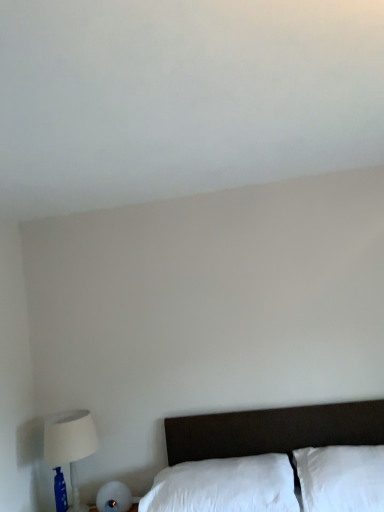
Where is `white soft pillow at lower center, positioned as the 1th pillow in left-to-right order`? This screenshot has height=512, width=384. white soft pillow at lower center, positioned as the 1th pillow in left-to-right order is located at coordinates (224, 486).

Is white fabric lampshade at left with white soft pillow at lower right, the first pillow viewed from the right?

No, white fabric lampshade at left is not next to white soft pillow at lower right, the first pillow viewed from the right.

Is the position of white fabric lampshade at left more distant than that of white soft pillow at lower right, which is the second pillow in left-to-right order?

Yes, white fabric lampshade at left is further from the viewer.

At what (x,y) coordinates should I click in order to perform the action: click on table lamp above the white soft pillow at lower right, which is the second pillow in left-to-right order (from a real-world perspective). Please return your answer as a coordinate pair (x, y). Image resolution: width=384 pixels, height=512 pixels. Looking at the image, I should click on (70, 445).

Which of these two, white fabric lampshade at left or white soft pillow at lower right, the first pillow viewed from the right, stands shorter?

With less height is white soft pillow at lower right, the first pillow viewed from the right.

Is white soft pillow at lower right, the first pillow viewed from the right, looking in the opposite direction of white soft pillow at lower center, positioned as the 1th pillow in left-to-right order?

No, white soft pillow at lower center, positioned as the 1th pillow in left-to-right order, is not at the back of white soft pillow at lower right, the first pillow viewed from the right.

Does white soft pillow at lower right, which is the second pillow in left-to-right order, have a larger size compared to white soft pillow at lower center, positioned as the 1th pillow in left-to-right order?

Incorrect, white soft pillow at lower right, which is the second pillow in left-to-right order, is not larger than white soft pillow at lower center, positioned as the 1th pillow in left-to-right order.

Can you confirm if white soft pillow at lower right, which is the second pillow in left-to-right order, is thinner than white soft pillow at lower center, the second pillow in the right-to-left sequence?

Correct, the width of white soft pillow at lower right, which is the second pillow in left-to-right order, is less than that of white soft pillow at lower center, the second pillow in the right-to-left sequence.

In the image, is white soft pillow at lower right, which is the second pillow in left-to-right order, positioned in front of or behind white soft pillow at lower center, positioned as the 1th pillow in left-to-right order?

In the image, white soft pillow at lower right, which is the second pillow in left-to-right order, appears in front of white soft pillow at lower center, positioned as the 1th pillow in left-to-right order.

Does white fabric lampshade at left have a lesser width compared to white soft pillow at lower center, positioned as the 1th pillow in left-to-right order?

Indeed, white fabric lampshade at left has a lesser width compared to white soft pillow at lower center, positioned as the 1th pillow in left-to-right order.

There is a white fabric lampshade at left. At what (x,y) coordinates should I click in order to perform the action: click on the 2nd pillow below it (from a real-world perspective). Please return your answer as a coordinate pair (x, y). This screenshot has height=512, width=384. Looking at the image, I should click on (224, 486).

Could you measure the distance between white fabric lampshade at left and white soft pillow at lower center, the second pillow in the right-to-left sequence?

They are 26.26 inches apart.

Considering the relative sizes of white fabric lampshade at left and white soft pillow at lower center, positioned as the 1th pillow in left-to-right order, in the image provided, is white fabric lampshade at left bigger than white soft pillow at lower center, positioned as the 1th pillow in left-to-right order,?

No.

Between white soft pillow at lower right, the first pillow viewed from the right, and white fabric lampshade at left, which one is positioned in front?

white soft pillow at lower right, the first pillow viewed from the right, is in front.

Is white soft pillow at lower right, which is the second pillow in left-to-right order, inside the boundaries of white fabric lampshade at left, or outside?

white soft pillow at lower right, which is the second pillow in left-to-right order, is outside white fabric lampshade at left.

Consider the image. Which object is thinner, white soft pillow at lower right, which is the second pillow in left-to-right order, or white fabric lampshade at left?

white fabric lampshade at left.

Is the surface of white soft pillow at lower right, which is the second pillow in left-to-right order, in direct contact with white fabric lampshade at left?

No, white soft pillow at lower right, which is the second pillow in left-to-right order, is not touching white fabric lampshade at left.

Considering the positions of objects white soft pillow at lower center, positioned as the 1th pillow in left-to-right order, and white fabric lampshade at left in the image provided, who is more to the right, white soft pillow at lower center, positioned as the 1th pillow in left-to-right order, or white fabric lampshade at left?

From the viewer's perspective, white soft pillow at lower center, positioned as the 1th pillow in left-to-right order, appears more on the right side.

Which of these two, white soft pillow at lower center, positioned as the 1th pillow in left-to-right order, or white fabric lampshade at left, is bigger?

Bigger between the two is white soft pillow at lower center, positioned as the 1th pillow in left-to-right order.

From the picture: From the image's perspective, which object appears higher, white soft pillow at lower center, the second pillow in the right-to-left sequence, or white fabric lampshade at left?

white fabric lampshade at left, from the image's perspective.

From a real-world perspective, count 2nd pillows downward from the white fabric lampshade at left and point to it. Please provide its 2D coordinates.

[(224, 486)]

In the scene shown: Measure the distance between white soft pillow at lower center, positioned as the 1th pillow in left-to-right order, and white soft pillow at lower right, which is the second pillow in left-to-right order.

A distance of 26.45 centimeters exists between white soft pillow at lower center, positioned as the 1th pillow in left-to-right order, and white soft pillow at lower right, which is the second pillow in left-to-right order.

Is white soft pillow at lower center, positioned as the 1th pillow in left-to-right order, aimed at white soft pillow at lower right, which is the second pillow in left-to-right order?

No, white soft pillow at lower center, positioned as the 1th pillow in left-to-right order, is not turned towards white soft pillow at lower right, which is the second pillow in left-to-right order.

Would you consider white soft pillow at lower center, the second pillow in the right-to-left sequence, to be distant from white soft pillow at lower right, which is the second pillow in left-to-right order?

No.

Who is more distant, white soft pillow at lower center, positioned as the 1th pillow in left-to-right order, or white soft pillow at lower right, the first pillow viewed from the right?

white soft pillow at lower center, positioned as the 1th pillow in left-to-right order, is further away from the camera.

What are the coordinates of `table lamp on the left of the white soft pillow at lower right, the first pillow viewed from the right` in the screenshot? It's located at (70, 445).

At what (x,y) coordinates should I click in order to perform the action: click on pillow above the white soft pillow at lower center, positioned as the 1th pillow in left-to-right order (from the image's perspective). Please return your answer as a coordinate pair (x, y). The height and width of the screenshot is (512, 384). Looking at the image, I should click on (341, 478).

From the image, which object appears to be nearer to white soft pillow at lower right, the first pillow viewed from the right, white fabric lampshade at left or white soft pillow at lower center, the second pillow in the right-to-left sequence?

white soft pillow at lower center, the second pillow in the right-to-left sequence, lies closer to white soft pillow at lower right, the first pillow viewed from the right, than the other object.

Estimate the real-world distances between objects in this image. Which object is further from white soft pillow at lower center, the second pillow in the right-to-left sequence, white soft pillow at lower right, the first pillow viewed from the right, or white fabric lampshade at left?

The object further to white soft pillow at lower center, the second pillow in the right-to-left sequence, is white fabric lampshade at left.

Looking at the image, which one is located further to white fabric lampshade at left, white soft pillow at lower center, positioned as the 1th pillow in left-to-right order, or white soft pillow at lower right, the first pillow viewed from the right?

white soft pillow at lower right, the first pillow viewed from the right.

Which object lies further to the anchor point white fabric lampshade at left, white soft pillow at lower right, which is the second pillow in left-to-right order, or white soft pillow at lower center, the second pillow in the right-to-left sequence?

Among the two, white soft pillow at lower right, which is the second pillow in left-to-right order, is located further to white fabric lampshade at left.

When comparing their distances from white soft pillow at lower center, the second pillow in the right-to-left sequence, does white fabric lampshade at left or white soft pillow at lower right, the first pillow viewed from the right, seem further?

white fabric lampshade at left lies further to white soft pillow at lower center, the second pillow in the right-to-left sequence, than the other object.

When comparing their distances from white soft pillow at lower right, which is the second pillow in left-to-right order, does white soft pillow at lower center, positioned as the 1th pillow in left-to-right order, or white fabric lampshade at left seem further?

white fabric lampshade at left lies further to white soft pillow at lower right, which is the second pillow in left-to-right order, than the other object.

Identify the location of pillow between white fabric lampshade at left and white soft pillow at lower right, the first pillow viewed from the right, from left to right. (224, 486).